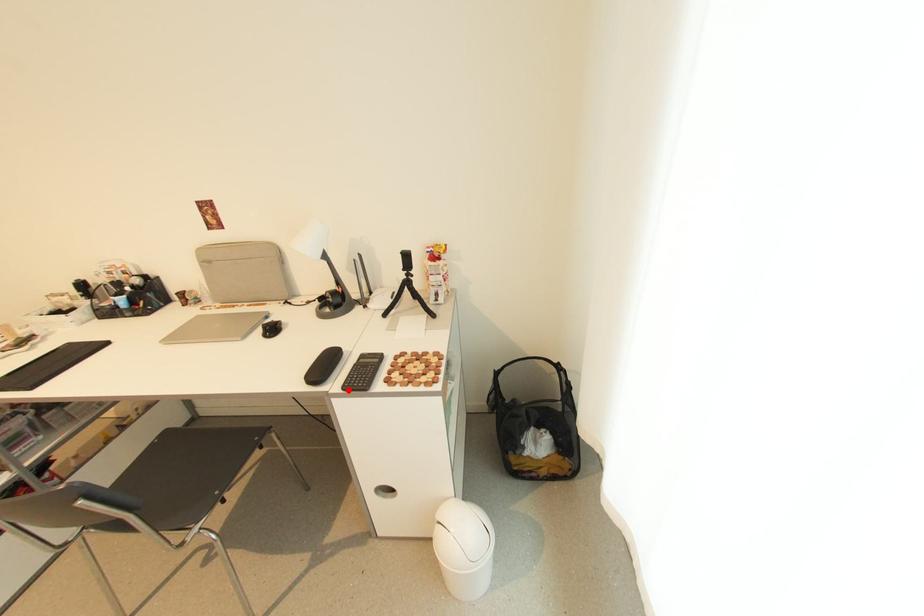
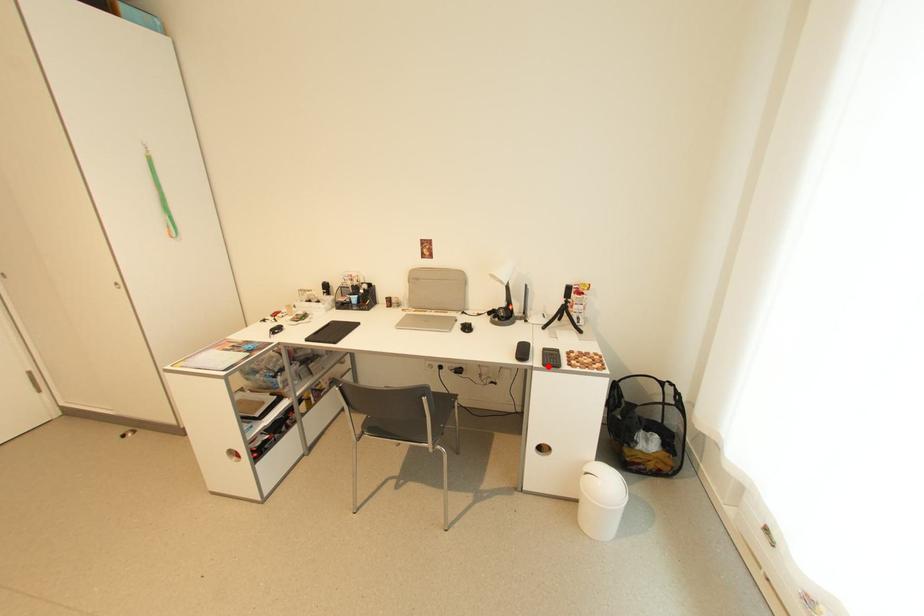
I am providing you with two images of the same scene from different viewpoints. A red point is marked on the first image and another point is marked on the second image. Is the red point in image1 aligned with the point shown in image2?

Yes